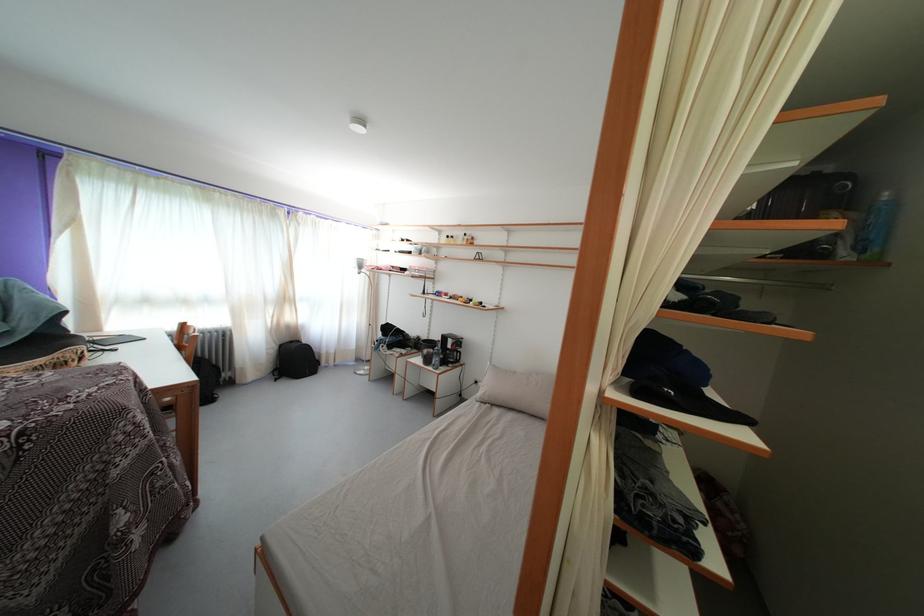
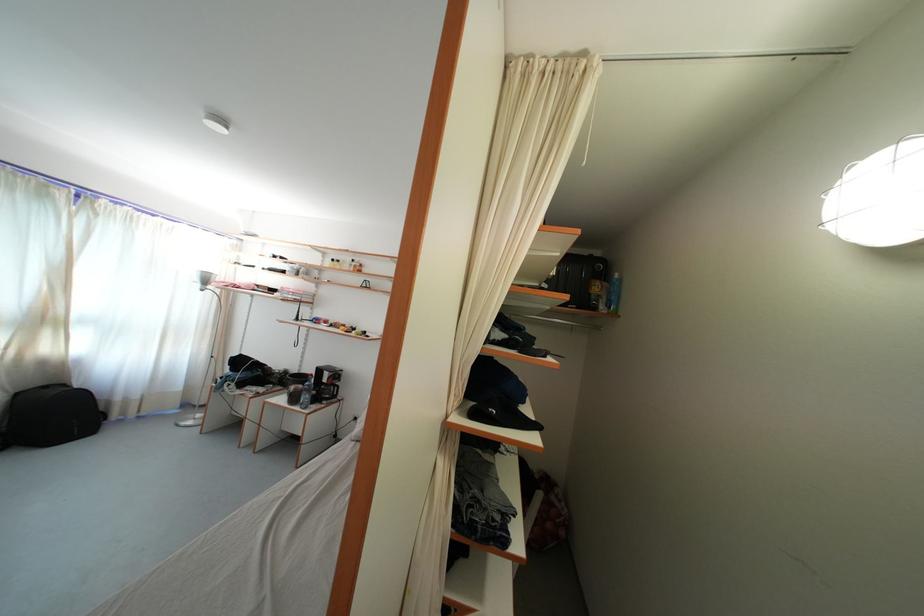
The point at (286,352) is marked in the first image. Where is the corresponding point in the second image?

(23, 400)